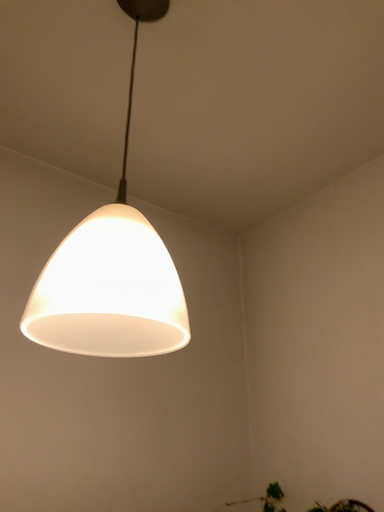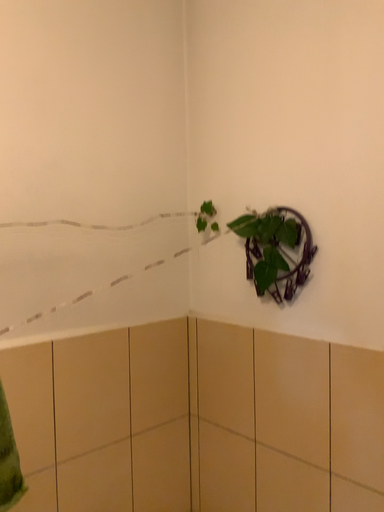
Question: How did the camera likely rotate when shooting the video?

Choices:
 (A) rotated downward
 (B) rotated upward

Answer: (A)